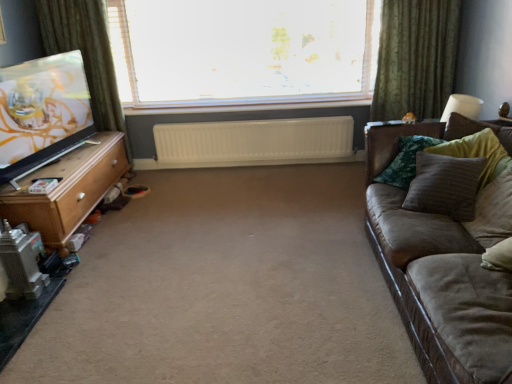
The height and width of the screenshot is (384, 512). I want to click on free space above white plastic radiator at center (from a real-world perspective), so click(x=243, y=122).